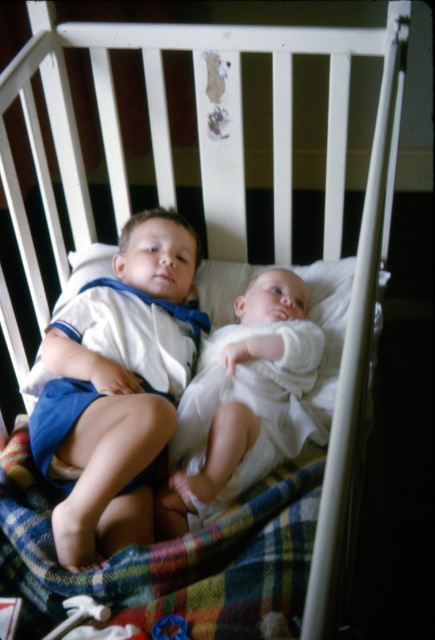
Who is more distant from viewer, (16, 451) or (196, 461)?

Positioned behind is point (16, 451).

Can you confirm if plaid fabric at center is bigger than white soft baby at center?

Yes, plaid fabric at center is bigger than white soft baby at center.

Is point (295, 632) behind point (204, 406)?

That is False.

At what (x,y) coordinates should I click in order to perform the action: click on plaid fabric at center. Please return your answer as a coordinate pair (x, y). The image size is (435, 640). Looking at the image, I should click on (169, 556).

Does white cotton shirt at center have a smaller size compared to white soft baby at center?

Actually, white cotton shirt at center might be larger than white soft baby at center.

Which is in front, point (94, 545) or point (214, 339)?

Positioned in front is point (94, 545).

Locate an element on the screen. white cotton shirt at center is located at coordinates (117, 387).

The height and width of the screenshot is (640, 435). Find the location of `white cotton shirt at center`. white cotton shirt at center is located at coordinates (117, 387).

Which of these two, white cotton shirt at center or plaid fabric at center, stands taller?

white cotton shirt at center is taller.

Is white cotton shirt at center to the left of plaid fabric at center from the viewer's perspective?

Correct, you'll find white cotton shirt at center to the left of plaid fabric at center.

At what (x,y) coordinates should I click in order to perform the action: click on white cotton shirt at center. Please return your answer as a coordinate pair (x, y). This screenshot has height=640, width=435. Looking at the image, I should click on (117, 387).